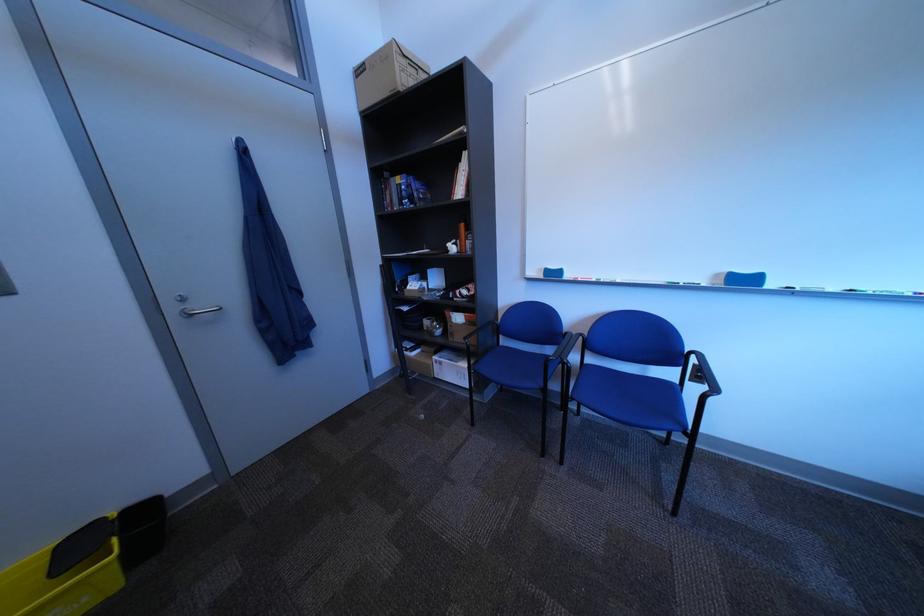
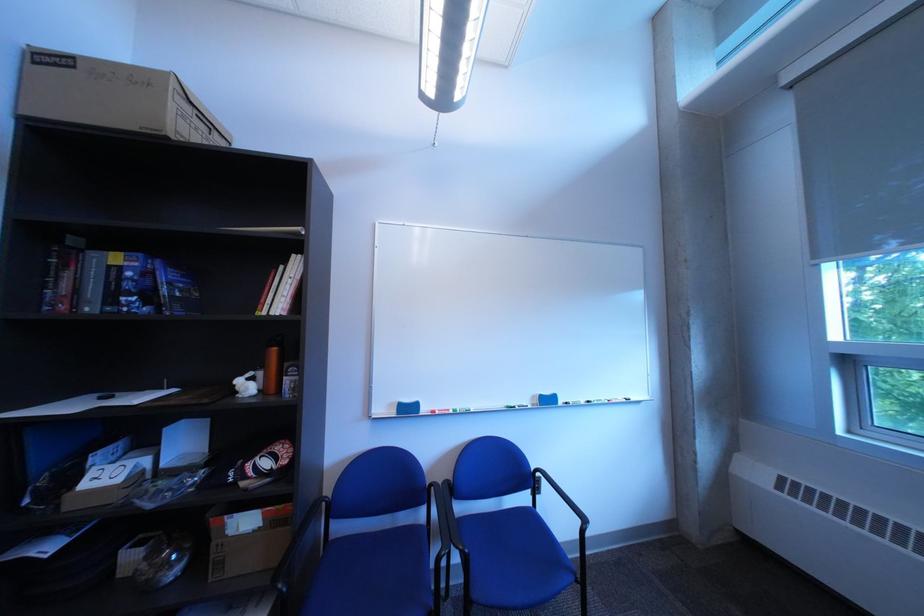
Locate, in the second image, the point that corresponds to point 468,336 in the first image.

(237, 565)